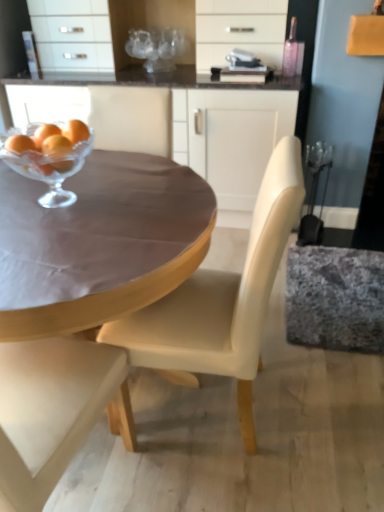
Where is `vacant space in front of clear glass bowl at center`? This screenshot has width=384, height=512. vacant space in front of clear glass bowl at center is located at coordinates (59, 233).